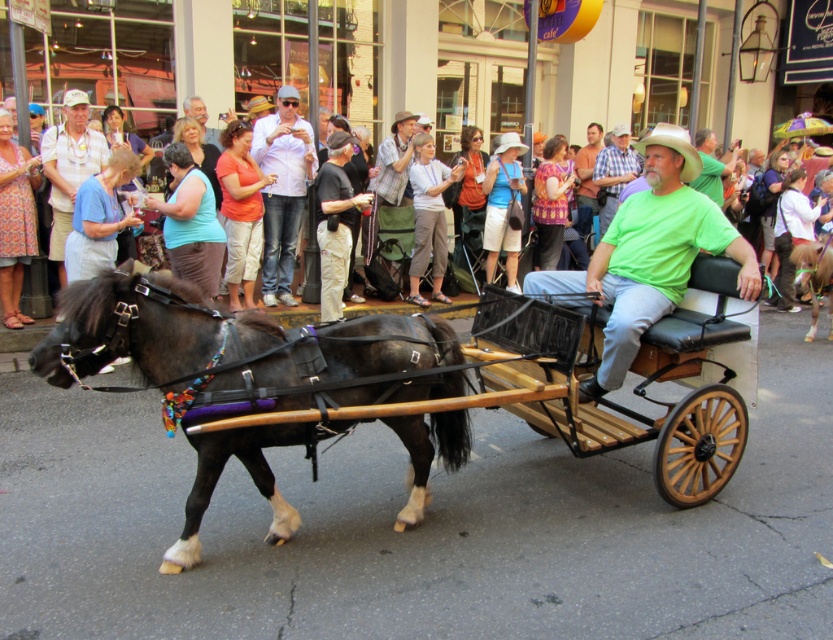
Does printed fabric dress at center have a greater height compared to shiny brown pony at center?

Yes, printed fabric dress at center is taller than shiny brown pony at center.

Based on the photo, who is positioned more to the right, printed fabric dress at center or shiny brown pony at center?

Positioned to the right is shiny brown pony at center.

Which is in front, point (18, 168) or point (821, 259)?

Point (18, 168) is in front.

This screenshot has width=833, height=640. What are the coordinates of `printed fabric dress at center` in the screenshot? It's located at coord(15,220).

Is green matte shirt at center above matte black horse at lower left?

Actually, green matte shirt at center is below matte black horse at lower left.

Image resolution: width=833 pixels, height=640 pixels. Identify the location of green matte shirt at center. click(x=651, y=253).

Who is more forward, (642, 248) or (609, 189)?

Positioned in front is point (642, 248).

You are a GUI agent. You are given a task and a screenshot of the screen. Output one action in this format:
    pyautogui.click(x=<x>, y=<y>)
    Task: Click on the green matte shirt at center
    
    Given the screenshot: What is the action you would take?
    pyautogui.click(x=651, y=253)

Does point (65, 304) come behind point (829, 300)?

No, (65, 304) is closer to viewer.

Does shiny black horse at center have a smaller size compared to shiny brown pony at center?

Actually, shiny black horse at center might be larger than shiny brown pony at center.

Find the location of a particular element. The width and height of the screenshot is (833, 640). shiny black horse at center is located at coordinates (128, 330).